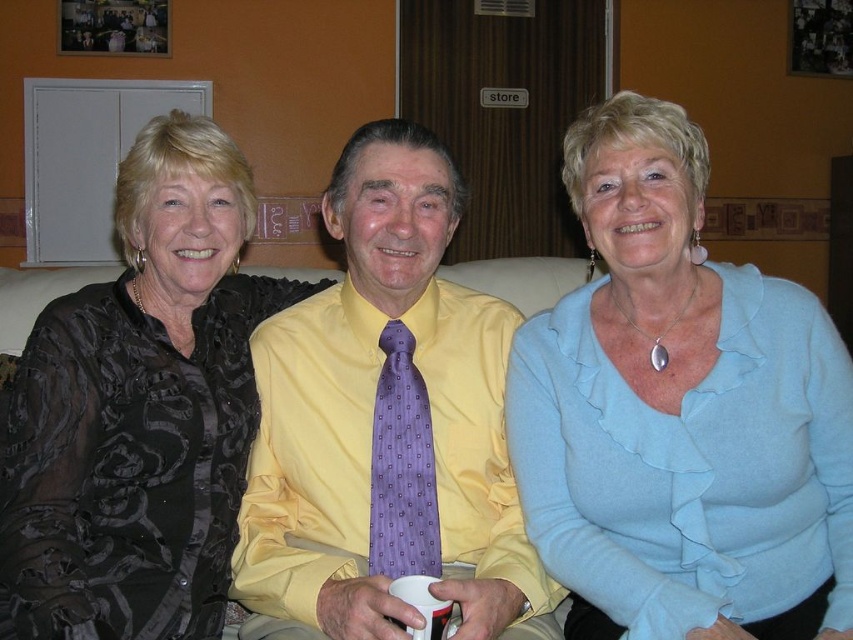
You are standing in the room and want to place a small decoration exactly at the point marked as point (129,570). If the decoration requires a minimum of 4 feet of space in front of it to be safe, will this location work?

The distance of point (129,570) from the camera is 3.87 feet, which is less than the required 4 feet. Therefore, placing the decoration there would not provide enough space and might be unsafe.

Based on the photo, you are a photographer who needs to adjust the lighting to ensure both the yellow satin shirt at center and the black satin blouse at left are well lit. Which object is positioned higher in the frame to help you focus the light accordingly?

The yellow satin shirt at center is located above the black satin blouse at left, so you should focus the light on the higher position where the yellow satin shirt at center is placed.

What is the exact coordinate of the light blue fabric at center?

The light blue fabric at center is located at coordinate point (x=680, y=412).